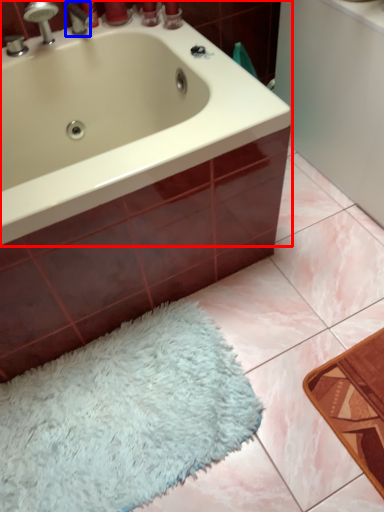
Question: Which object appears closest to the camera in this image, bathtub (highlighted by a red box) or tap (highlighted by a blue box)?

Choices:
 (A) bathtub
 (B) tap

Answer: (A)